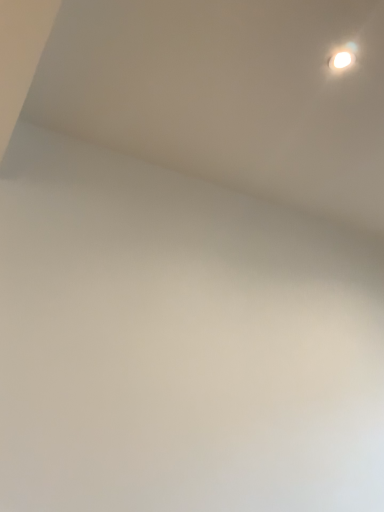
What do you see at coordinates (341, 59) in the screenshot? This screenshot has height=512, width=384. I see `white glossy light fixture at upper right` at bounding box center [341, 59].

I want to click on white glossy light fixture at upper right, so click(341, 59).

What is the approximate height of white glossy light fixture at upper right?

It is 0.56 inches.

Where is `white glossy light fixture at upper right`? This screenshot has height=512, width=384. white glossy light fixture at upper right is located at coordinates (341, 59).